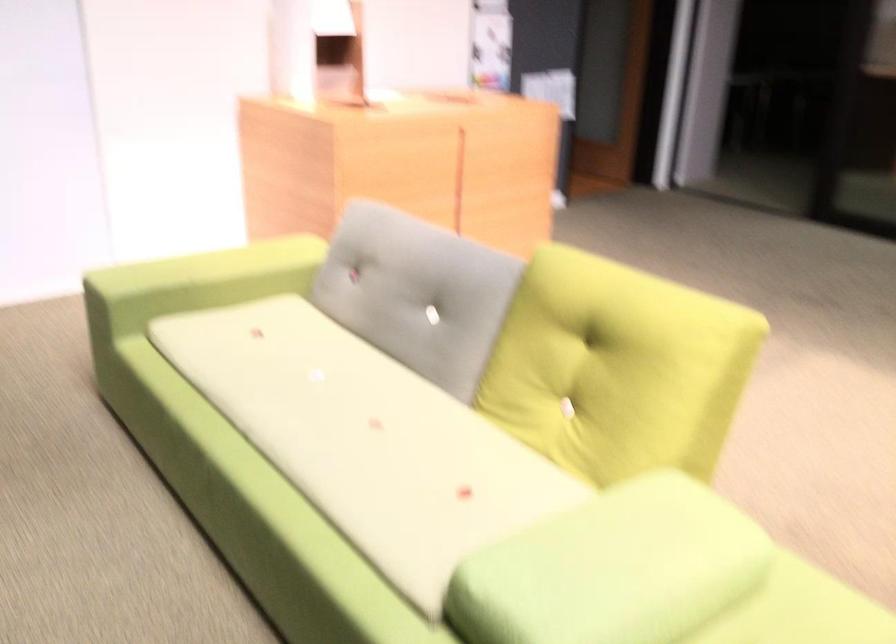
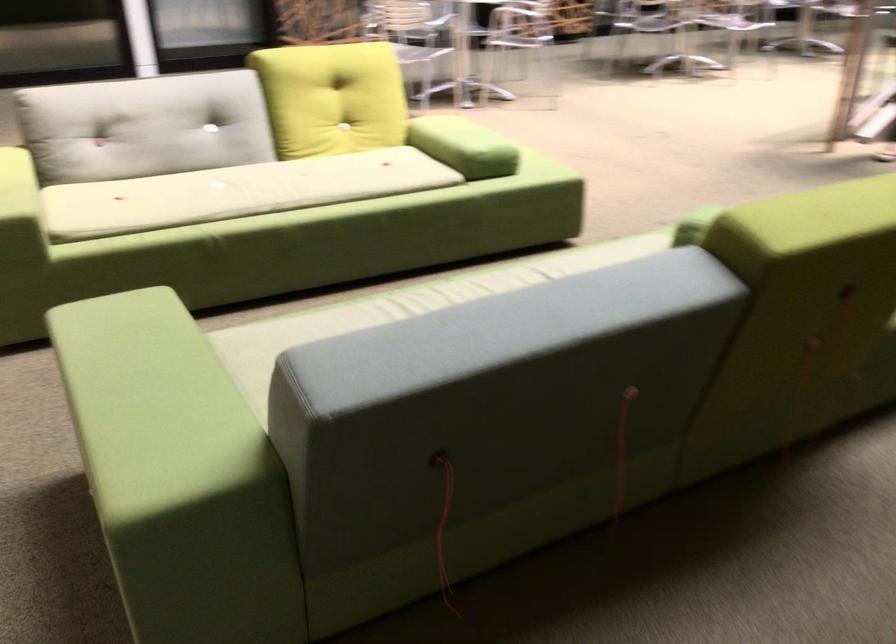
In the second image, find the point that corresponds to point 93,274 in the first image.

(19, 207)